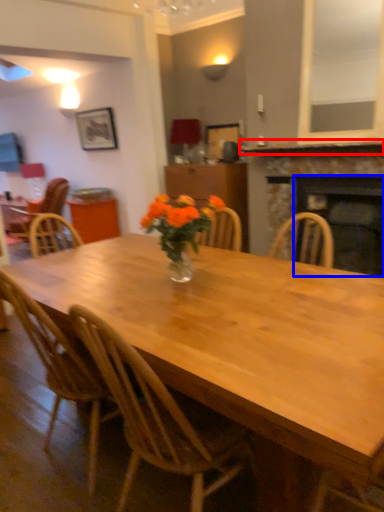
Question: Which object is closer to the camera taking this photo, mantle (highlighted by a red box) or fireplace (highlighted by a blue box)?

Choices:
 (A) mantle
 (B) fireplace

Answer: (A)